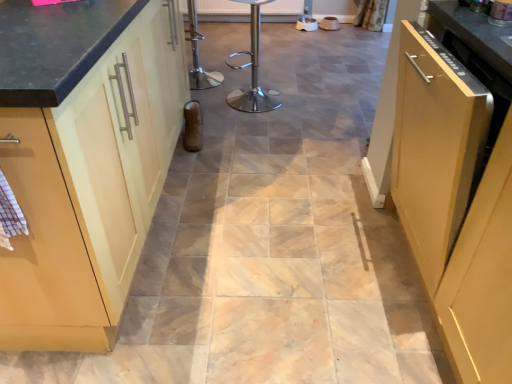
Question: Does matte wood cabinet at left, the first cabinetry in the left-to-right sequence, have a lesser height compared to metallic silver dishwasher at upper right?

Choices:
 (A) no
 (B) yes

Answer: (A)

Question: Does matte wood cabinet at left, the first cabinetry in the left-to-right sequence, lie in front of metallic silver dishwasher at upper right?

Choices:
 (A) yes
 (B) no

Answer: (A)

Question: Is matte wood cabinet at left, which is counted as the 2th cabinetry, starting from the right, not near metallic silver dishwasher at upper right?

Choices:
 (A) no
 (B) yes

Answer: (B)

Question: Can we say matte wood cabinet at left, which is counted as the 2th cabinetry, starting from the right, lies outside metallic silver dishwasher at upper right?

Choices:
 (A) no
 (B) yes

Answer: (B)

Question: From the image's perspective, is matte wood cabinet at left, which is counted as the 2th cabinetry, starting from the right, over metallic silver dishwasher at upper right?

Choices:
 (A) no
 (B) yes

Answer: (A)

Question: Considering the positions of point (509, 18) and point (266, 92), is point (509, 18) closer or farther from the camera than point (266, 92)?

Choices:
 (A) farther
 (B) closer

Answer: (B)

Question: Is metallic silver dishwasher at upper right situated inside polished stainless steel bar stool at center or outside?

Choices:
 (A) outside
 (B) inside

Answer: (A)

Question: From a real-world perspective, relative to polished stainless steel bar stool at center, is metallic silver dishwasher at upper right vertically above or below?

Choices:
 (A) below
 (B) above

Answer: (B)

Question: Is metallic silver dishwasher at upper right to the left or to the right of polished stainless steel bar stool at center in the image?

Choices:
 (A) right
 (B) left

Answer: (A)

Question: Is polished stainless steel bar stool at center situated inside metallic silver dishwasher at upper right or outside?

Choices:
 (A) outside
 (B) inside

Answer: (A)

Question: Considering the positions of polished stainless steel bar stool at center and metallic silver dishwasher at upper right in the image, is polished stainless steel bar stool at center bigger or smaller than metallic silver dishwasher at upper right?

Choices:
 (A) small
 (B) big

Answer: (B)

Question: From a real-world perspective, is polished stainless steel bar stool at center physically located above or below metallic silver dishwasher at upper right?

Choices:
 (A) below
 (B) above

Answer: (A)

Question: From the image's perspective, is polished stainless steel bar stool at center located above or below metallic silver dishwasher at upper right?

Choices:
 (A) below
 (B) above

Answer: (B)

Question: From their relative heights in the image, would you say matte wood cabinet at right, marked as the second cabinetry in a left-to-right arrangement, is taller or shorter than metallic silver dishwasher at upper right?

Choices:
 (A) short
 (B) tall

Answer: (B)

Question: Do you think matte wood cabinet at right, marked as the first cabinetry in a right-to-left arrangement, is within metallic silver dishwasher at upper right, or outside of it?

Choices:
 (A) inside
 (B) outside

Answer: (B)